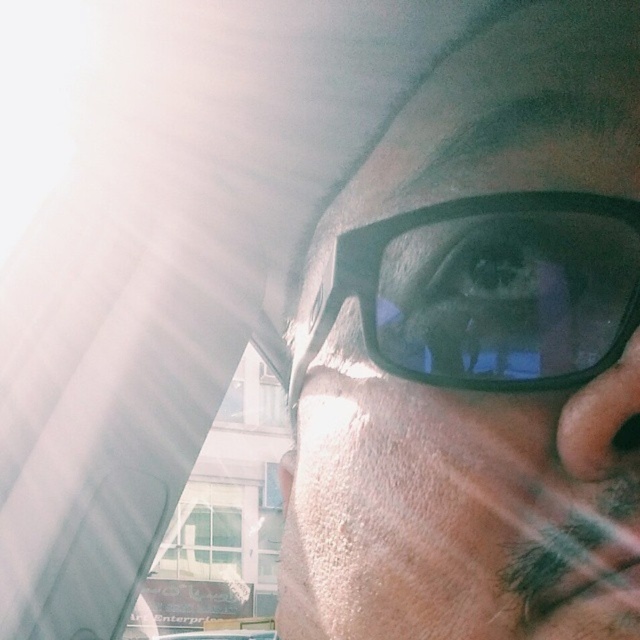
Question: In this image, where is matte black glasses at center located relative to black matte glasses at center?

Choices:
 (A) left
 (B) right

Answer: (B)

Question: Does matte black glasses at center have a larger size compared to black matte glasses at center?

Choices:
 (A) yes
 (B) no

Answer: (A)

Question: Which point is farther from the camera taking this photo?

Choices:
 (A) (502, 202)
 (B) (621, 396)

Answer: (A)

Question: Is matte black glasses at center wider than black matte glasses at center?

Choices:
 (A) yes
 (B) no

Answer: (A)